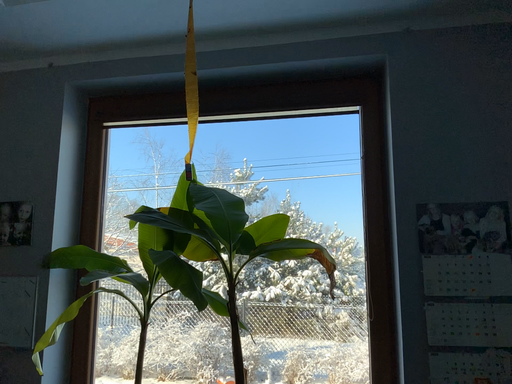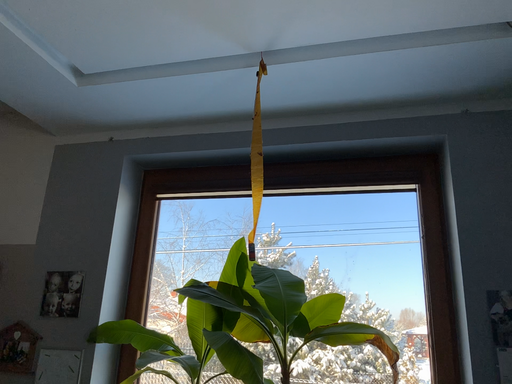
Question: Which way did the camera rotate in the video?

Choices:
 (A) rotated upward
 (B) rotated downward

Answer: (A)